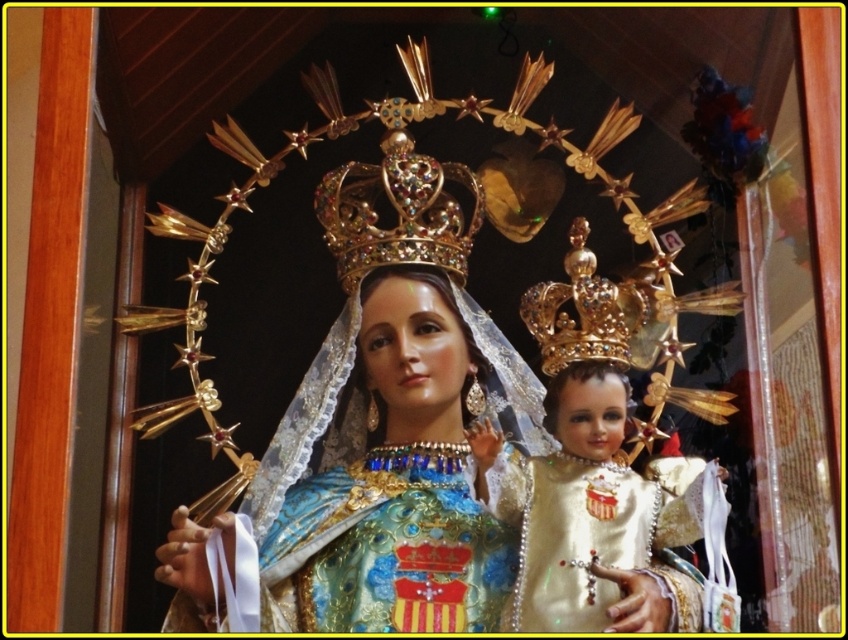
Which is more to the right, gold glossy crown at center or gold shiny crown at upper center?

Positioned to the right is gold shiny crown at upper center.

Can you confirm if gold glossy crown at center is smaller than gold shiny crown at upper center?

Incorrect, gold glossy crown at center is not smaller in size than gold shiny crown at upper center.

Between point (483, 493) and point (595, 307), which one is positioned in front?

Point (483, 493) is in front.

Locate an element on the screen. The width and height of the screenshot is (848, 640). gold glossy crown at center is located at coordinates pyautogui.click(x=579, y=464).

Who is shorter, gold jeweled crown at center or gold shiny crown at upper center?

Standing shorter between the two is gold shiny crown at upper center.

Does gold jeweled crown at center have a greater height compared to gold shiny crown at upper center?

Yes.

This screenshot has width=848, height=640. Describe the element at coordinates (395, 212) in the screenshot. I see `gold jeweled crown at center` at that location.

At what (x,y) coordinates should I click in order to perform the action: click on gold jeweled crown at center. Please return your answer as a coordinate pair (x, y). This screenshot has width=848, height=640. Looking at the image, I should click on (395, 212).

Is gold glossy crown at center bigger than gold jeweled crown at center?

Correct, gold glossy crown at center is larger in size than gold jeweled crown at center.

Does gold glossy crown at center have a lesser width compared to gold jeweled crown at center?

No, gold glossy crown at center is not thinner than gold jeweled crown at center.

Who is more forward, (551, 515) or (444, 205)?

Point (551, 515) is more forward.

The height and width of the screenshot is (640, 848). What are the coordinates of `gold glossy crown at center` in the screenshot? It's located at (579, 464).